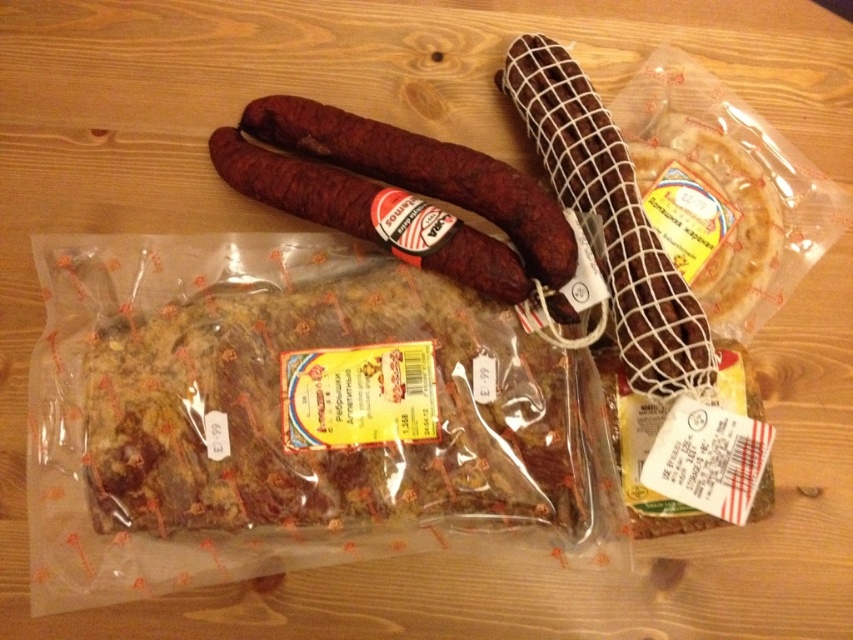
You are a customer at a deli counter and want to buy both the dark brown netted sausage at upper right and the dark red textured sausage at center. The store has a policy that only allows purchasing the larger sausage. Which one should you choose?

The dark brown netted sausage at upper right is bigger than the dark red textured sausage at center, so you should choose the dark brown netted sausage at upper right.

What is the location of the point with coordinates (610, 218) in relation to the dark brown netted sausage at upper right?

The point with coordinates (610, 218) is located on the dark brown netted sausage at upper right.